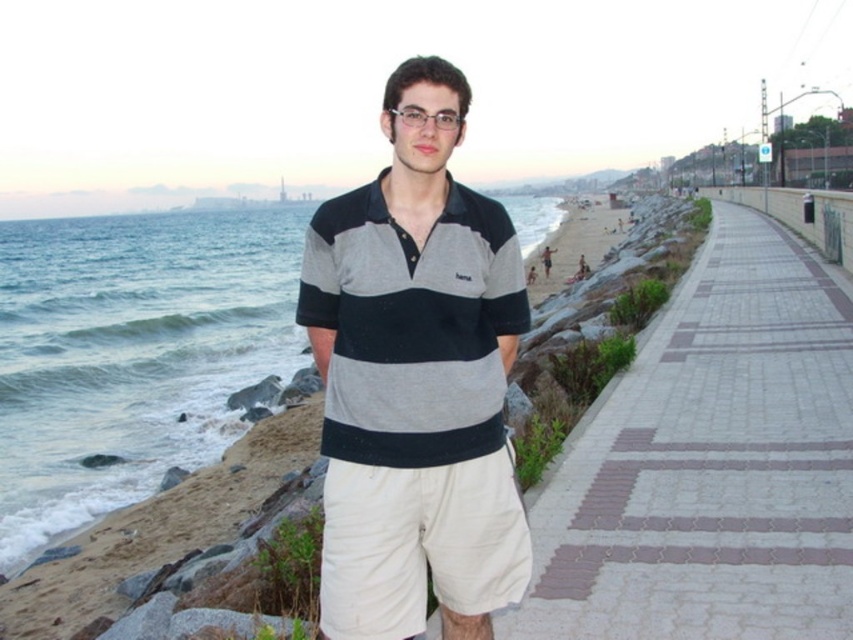
Question: Which object is positioned farthest from the beige cotton shorts at center?

Choices:
 (A) paved stone walkway at right
 (B) striped cotton polo shirt at center

Answer: (A)

Question: Which point is closer to the camera?

Choices:
 (A) tap(416, 230)
 (B) tap(335, 524)
 (C) tap(756, 506)

Answer: (B)

Question: Where is paved stone walkway at right located in relation to beige cotton shorts at center in the image?

Choices:
 (A) above
 (B) below

Answer: (A)

Question: Does paved stone walkway at right come in front of beige cotton shorts at center?

Choices:
 (A) no
 (B) yes

Answer: (A)

Question: Among these objects, which one is nearest to the camera?

Choices:
 (A) paved stone walkway at right
 (B) striped cotton polo shirt at center
 (C) beige cotton shorts at center

Answer: (C)

Question: Can you confirm if striped cotton polo shirt at center is thinner than beige cotton shorts at center?

Choices:
 (A) no
 (B) yes

Answer: (A)